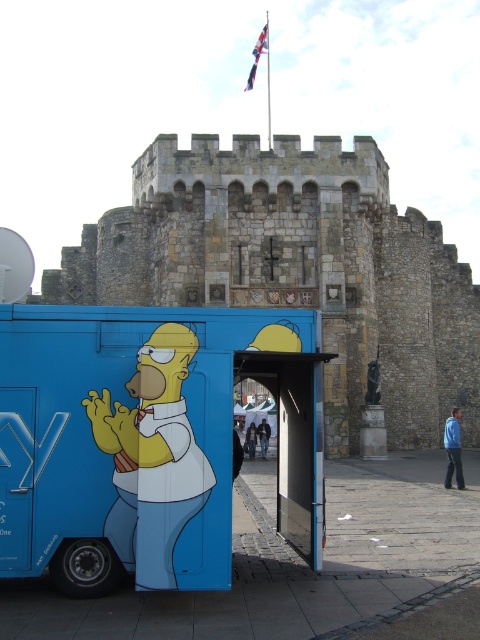
In the scene shown: You are a tourist visiting a historical site and see the matte blue food truck at center and the stone castle at center. Which one is more to the left?

The matte blue food truck at center is more to the left because it is positioned on the left side of the stone castle at center.

You are planning to drive a delivery truck that is 2 meters wide through the space between the matte blue food truck at center and the stone castle at center. Can your delivery truck fit through the space?

The matte blue food truck at center is thinner than the stone castle at center, so the space between them may be narrow. However, without knowing the exact distance between the two objects, it is impossible to determine if the 2 meter wide delivery truck can fit through the space.